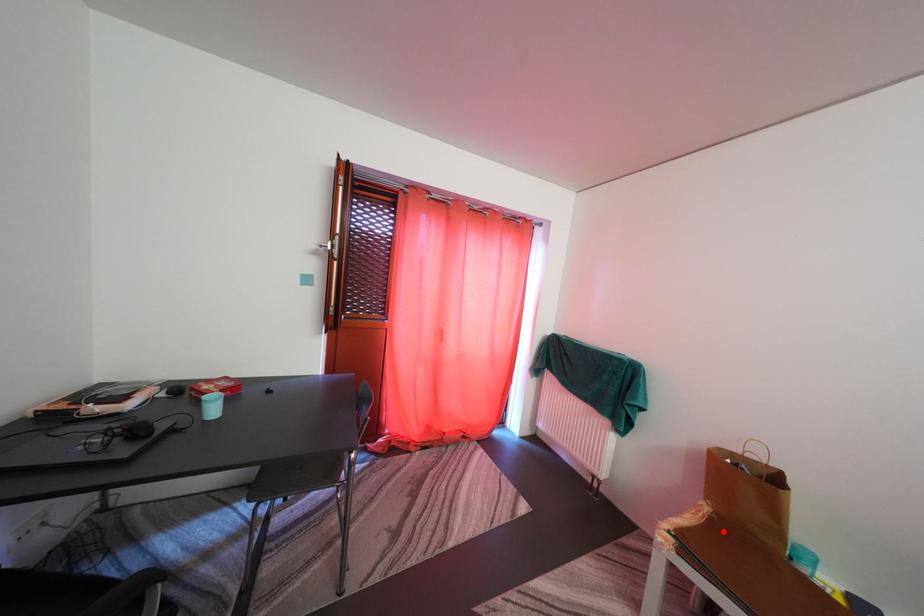
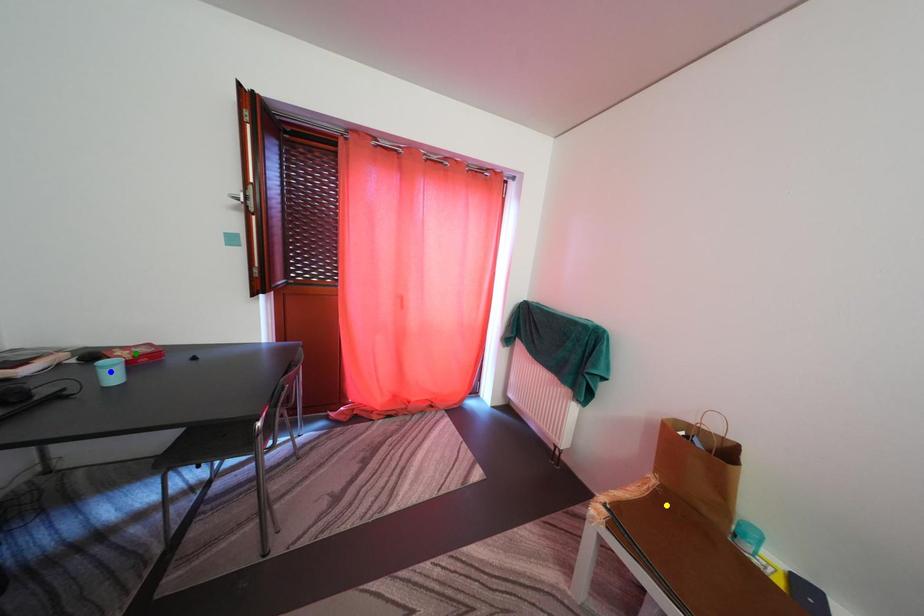
Question: I am providing you with two images of the same scene from different viewpoints. A red point is marked on the first image. You are given multiple points on the second image. Which point in image 2 is actually the same real-world point as the red point in image 1?

Choices:
 (A) yellow point
 (B) blue point
 (C) green point

Answer: (A)